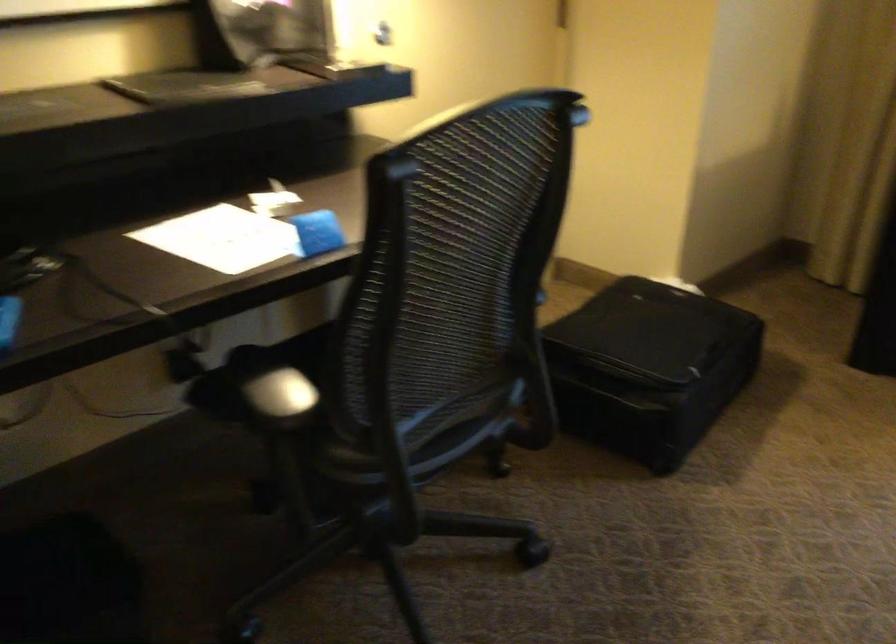
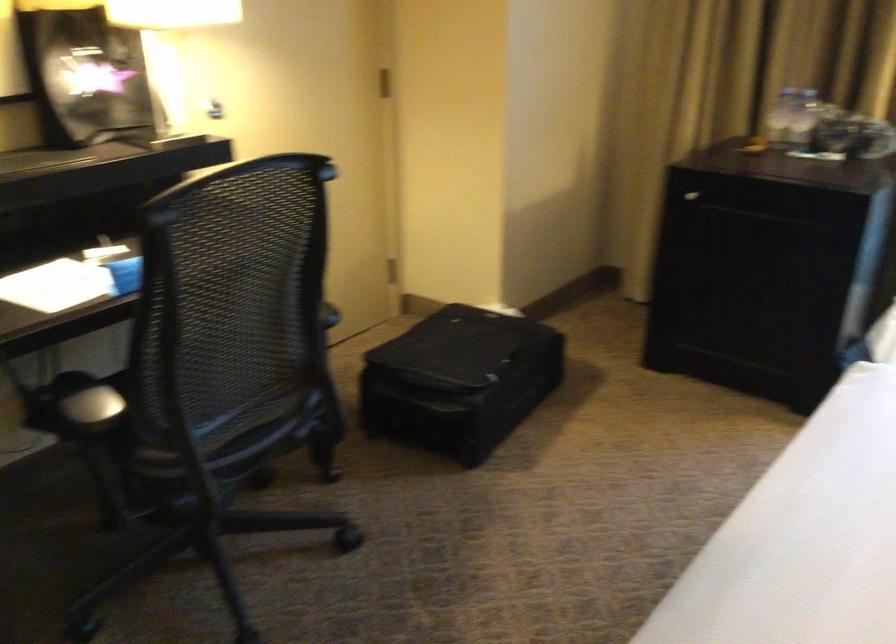
Question: The images are taken continuously from a first-person perspective. In which direction is your viewpoint rotating?

Choices:
 (A) Left
 (B) Right
 (C) Up
 (D) Down

Answer: (B)